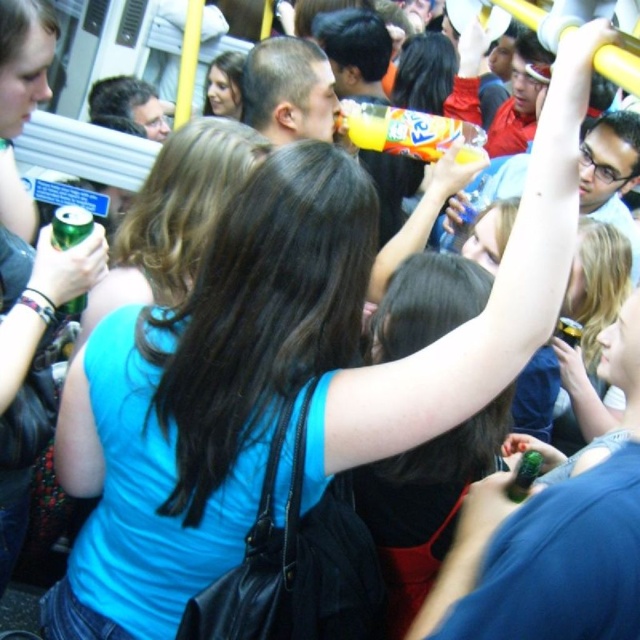
Between translucent orange bottle at upper center and green matte can at upper left, which one has more height?

Standing taller between the two is translucent orange bottle at upper center.

Is translucent orange bottle at upper center smaller than green matte can at upper left?

Actually, translucent orange bottle at upper center might be larger than green matte can at upper left.

Which is behind, point (460, 160) or point (52, 243)?

Positioned behind is point (460, 160).

This screenshot has width=640, height=640. In order to click on translucent orange bottle at upper center in this screenshot , I will do `click(406, 131)`.

Can you confirm if translucent orange bottle at upper center is taller than green matte bottle at upper right?

Correct, translucent orange bottle at upper center is much taller as green matte bottle at upper right.

Does translucent orange bottle at upper center come in front of green matte bottle at upper right?

No.

Does point (376, 148) come closer to viewer compared to point (520, 476)?

No, it is not.

You are a GUI agent. You are given a task and a screenshot of the screen. Output one action in this format:
    pyautogui.click(x=<x>, y=<y>)
    Task: Click on the translucent orange bottle at upper center
    
    Given the screenshot: What is the action you would take?
    pyautogui.click(x=406, y=131)

Is point (362, 120) closer to camera compared to point (563, 330)?

No, (362, 120) is further to viewer.

Locate an element on the screen. The width and height of the screenshot is (640, 640). translucent orange bottle at upper center is located at coordinates (406, 131).

Is point (436, 147) less distant than point (563, 330)?

No, (436, 147) is behind (563, 330).

Find the location of `translucent orange bottle at upper center`. translucent orange bottle at upper center is located at coordinates point(406,131).